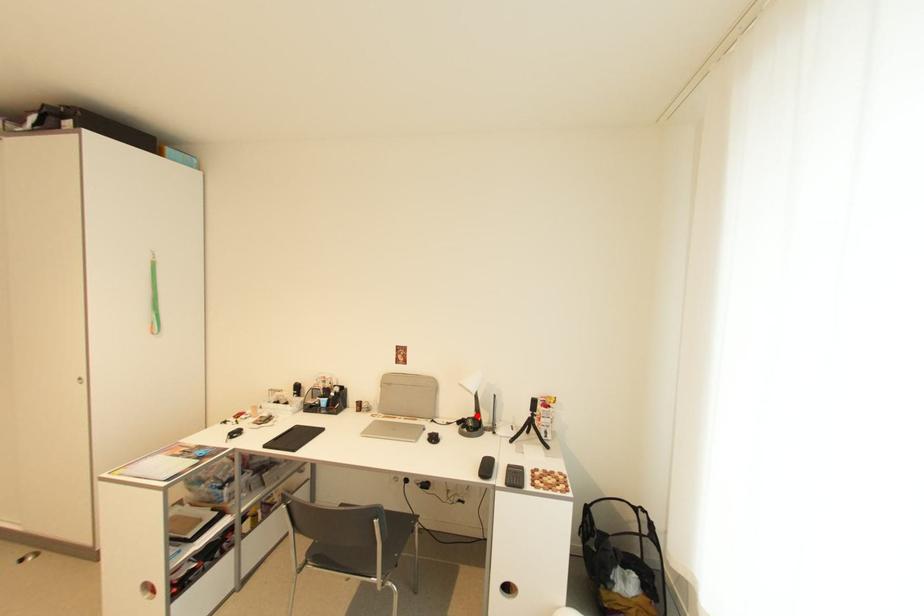
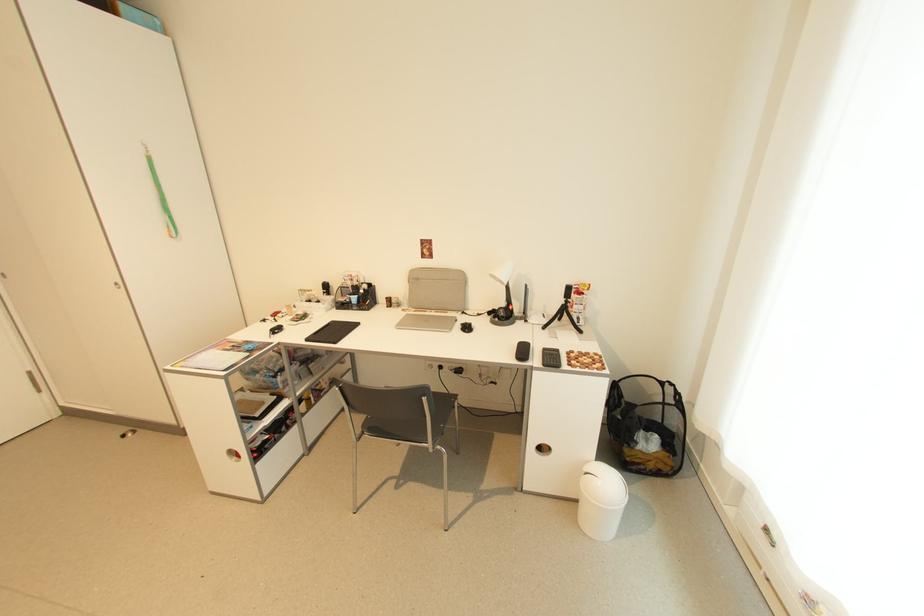
Question: I am providing you with two images of the same scene from different viewpoints. Given a red point in image1, look at the same physical point in image2. Is it:

Choices:
 (A) Closer to the viewpoint
 (B) Farther from the viewpoint

Answer: (A)